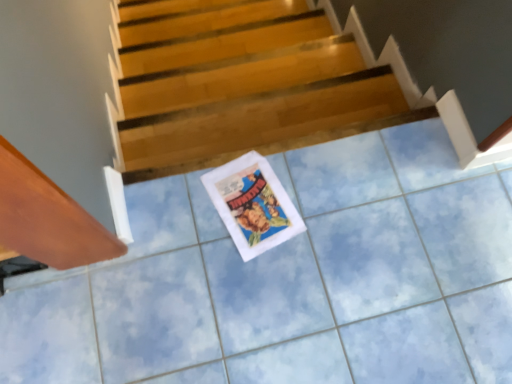
Where is `free spot to the right of white paper comic book at center`? free spot to the right of white paper comic book at center is located at coordinates coord(327,212).